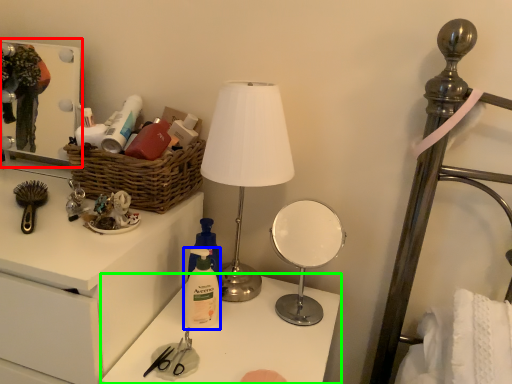
Question: Which is nearer to the medicine cabinet (highlighted by a red box)? toiletry (highlighted by a blue box) or table (highlighted by a green box).

Choices:
 (A) toiletry
 (B) table

Answer: (B)